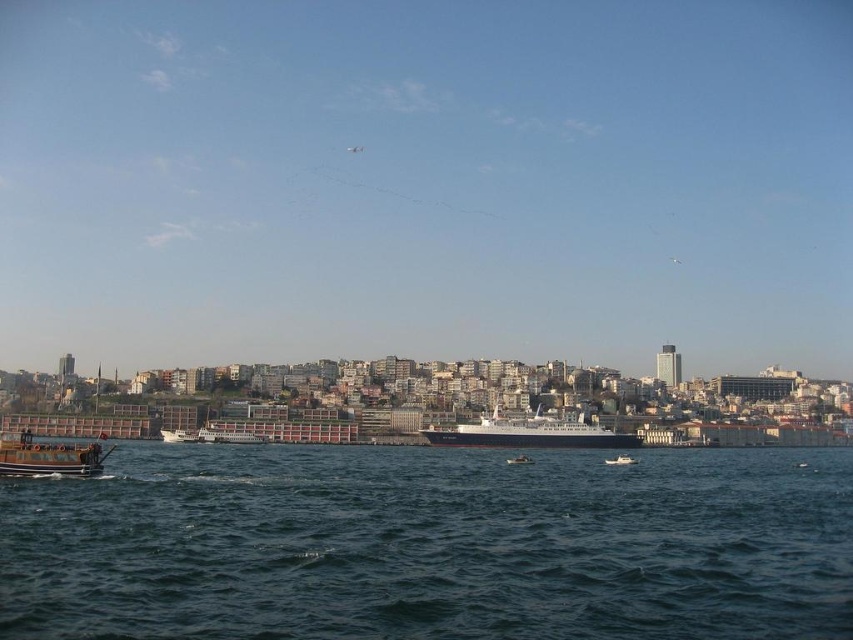
Describe the element at coordinates (178, 435) in the screenshot. The width and height of the screenshot is (853, 640). I see `white matte boat at center` at that location.

Is white matte boat at center to the right of white matte boat at lower center from the viewer's perspective?

Incorrect, white matte boat at center is not on the right side of white matte boat at lower center.

Which is in front, point (193, 429) or point (616, 460)?

Point (616, 460) is more forward.

At what (x,y) coordinates should I click in order to perform the action: click on white matte boat at center. Please return your answer as a coordinate pair (x, y). This screenshot has height=640, width=853. Looking at the image, I should click on (178, 435).

Does point (714, 518) come behind point (525, 461)?

No, it is in front of (525, 461).

Is point (334, 625) behind point (512, 460)?

No, (334, 625) is closer to viewer.

Identify the location of dark blue water at lower center. This screenshot has height=640, width=853. (431, 545).

Does wooden boat at lower left have a lesser width compared to white plastic boat at center?

No.

Can you confirm if wooden boat at lower left is positioned to the right of white plastic boat at center?

No, wooden boat at lower left is not to the right of white plastic boat at center.

The width and height of the screenshot is (853, 640). Find the location of `wooden boat at lower left`. wooden boat at lower left is located at coordinates (49, 458).